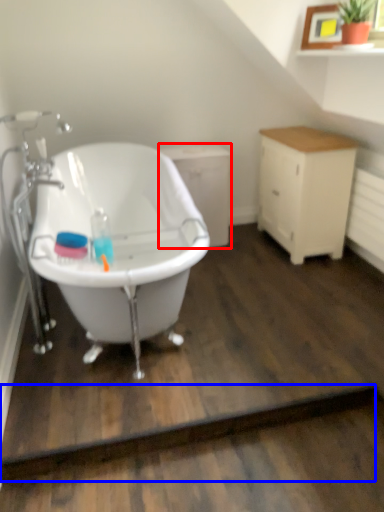
Question: Which of the following is the closest to the observer, cabinetry (highlighted by a red box) or plank (highlighted by a blue box)?

Choices:
 (A) cabinetry
 (B) plank

Answer: (B)